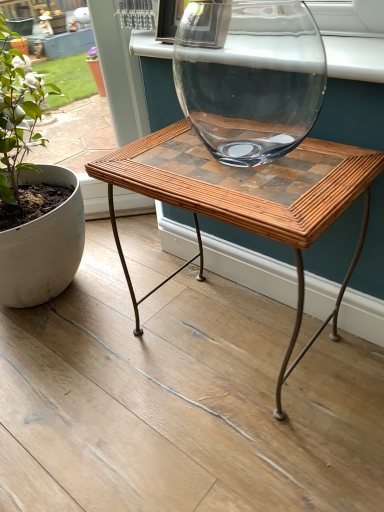
Question: Is green matte plant at left taller or shorter than woven wood table at center?

Choices:
 (A) tall
 (B) short

Answer: (A)

Question: Which is correct: green matte plant at left is inside woven wood table at center, or outside of it?

Choices:
 (A) inside
 (B) outside

Answer: (B)

Question: Which of these objects is positioned farthest from the woven wood table at center?

Choices:
 (A) green matte plant at left
 (B) clear glass vase at upper center

Answer: (A)

Question: Considering the real-world distances, which object is farthest from the woven wood table at center?

Choices:
 (A) green matte plant at left
 (B) clear glass vase at upper center

Answer: (A)